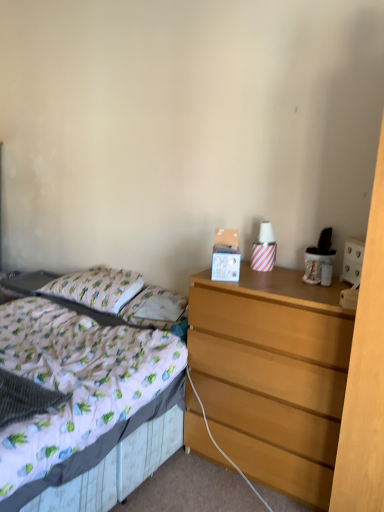
Question: Can you confirm if white fabric pillow at center, the first pillow positioned from the right, is thinner than cotton/cotton-like pillow at left, the second pillow viewed from the right?

Choices:
 (A) no
 (B) yes

Answer: (B)

Question: Is white fabric pillow at center, marked as the 2th pillow in a left-to-right arrangement, positioned beyond the bounds of cotton/cotton-like pillow at left, arranged as the 1th pillow when viewed from the left?

Choices:
 (A) no
 (B) yes

Answer: (B)

Question: Is cotton/cotton-like pillow at left, arranged as the 1th pillow when viewed from the left, at the back of white fabric pillow at center, the first pillow positioned from the right?

Choices:
 (A) no
 (B) yes

Answer: (A)

Question: Does white fabric pillow at center, the first pillow positioned from the right, have a smaller size compared to cotton/cotton-like pillow at left, arranged as the 1th pillow when viewed from the left?

Choices:
 (A) no
 (B) yes

Answer: (B)

Question: From the image's perspective, does white fabric pillow at center, the first pillow positioned from the right, appear lower than cotton/cotton-like pillow at left, the second pillow viewed from the right?

Choices:
 (A) no
 (B) yes

Answer: (B)

Question: Would you say white fabric pillow at center, marked as the 2th pillow in a left-to-right arrangement, is to the left or to the right of white fabric bed at left in the picture?

Choices:
 (A) right
 (B) left

Answer: (A)

Question: Considering the positions of white fabric pillow at center, marked as the 2th pillow in a left-to-right arrangement, and white fabric bed at left in the image, is white fabric pillow at center, marked as the 2th pillow in a left-to-right arrangement, bigger or smaller than white fabric bed at left?

Choices:
 (A) big
 (B) small

Answer: (B)

Question: From a real-world perspective, relative to white fabric bed at left, is white fabric pillow at center, marked as the 2th pillow in a left-to-right arrangement, vertically above or below?

Choices:
 (A) above
 (B) below

Answer: (A)

Question: From the image's perspective, relative to white fabric bed at left, is white fabric pillow at center, marked as the 2th pillow in a left-to-right arrangement, above or below?

Choices:
 (A) below
 (B) above

Answer: (B)

Question: Is white fabric bed at left spatially inside cotton/cotton-like pillow at left, the second pillow viewed from the right, or outside of it?

Choices:
 (A) inside
 (B) outside

Answer: (B)

Question: From a real-world perspective, relative to cotton/cotton-like pillow at left, arranged as the 1th pillow when viewed from the left, is white fabric bed at left vertically above or below?

Choices:
 (A) below
 (B) above

Answer: (A)

Question: Considering the positions of point (140, 396) and point (57, 288), is point (140, 396) closer or farther from the camera than point (57, 288)?

Choices:
 (A) farther
 (B) closer

Answer: (B)

Question: Relative to cotton/cotton-like pillow at left, the second pillow viewed from the right, is white fabric bed at left in front or behind?

Choices:
 (A) behind
 (B) front

Answer: (B)

Question: From their relative heights in the image, would you say white fabric bed at left is taller or shorter than wooden chest of drawers at right?

Choices:
 (A) tall
 (B) short

Answer: (B)

Question: From a real-world perspective, is white fabric bed at left physically located above or below wooden chest of drawers at right?

Choices:
 (A) above
 (B) below

Answer: (B)